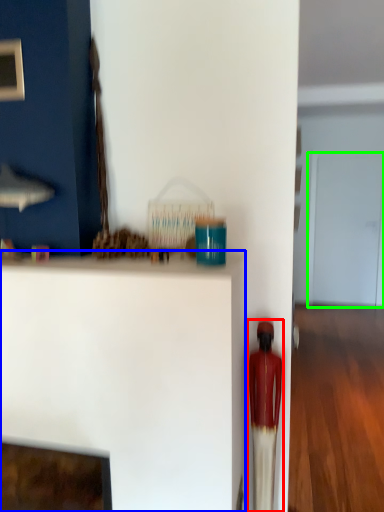
Question: Based on their relative distances, which object is nearer to toy (highlighted by a red box)? Choose from furniture (highlighted by a blue box) and glass door (highlighted by a green box).

Choices:
 (A) furniture
 (B) glass door

Answer: (A)